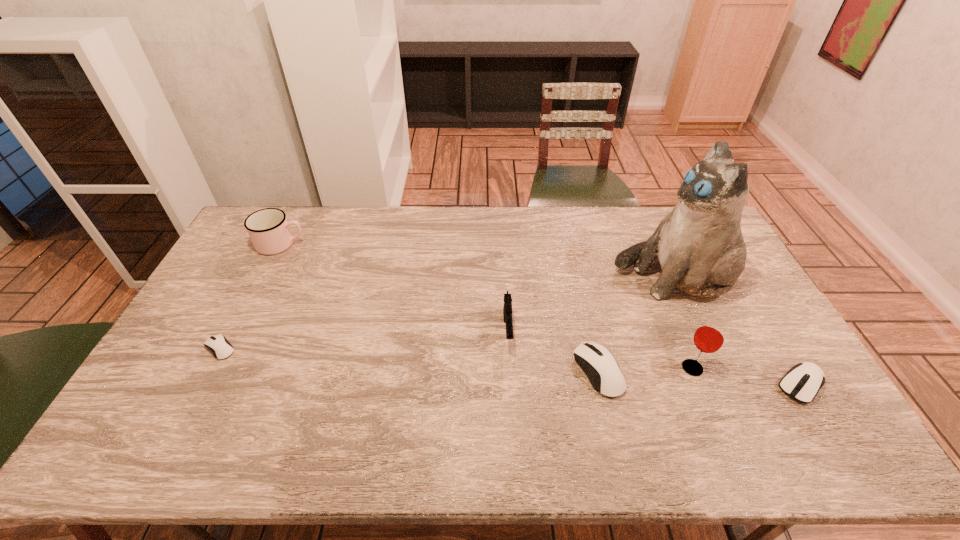
The height and width of the screenshot is (540, 960). Find the location of `spot to insert another mouse_(computer_equipment) for uniform distribution`. spot to insert another mouse_(computer_equipment) for uniform distribution is located at coordinates (405, 360).